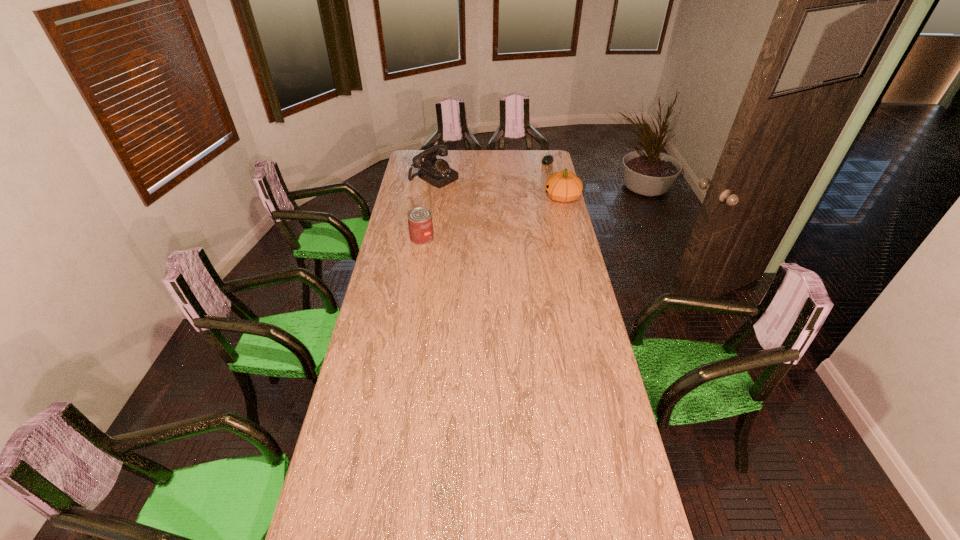
This screenshot has width=960, height=540. In order to click on free space between the gourd and the telephone in this screenshot , I will do [498, 188].

At what (x,y) coordinates should I click in order to perform the action: click on vacant area that lies between the gourd and the telephone. Please return your answer as a coordinate pair (x, y). This screenshot has height=540, width=960. Looking at the image, I should click on (498, 188).

At what (x,y) coordinates should I click in order to perform the action: click on empty space that is in between the can and the gourd. Please return your answer as a coordinate pair (x, y). Looking at the image, I should click on (492, 218).

This screenshot has width=960, height=540. Find the location of `unoccupied position between the third tallest object and the computer mouse`. unoccupied position between the third tallest object and the computer mouse is located at coordinates (485, 200).

This screenshot has width=960, height=540. I want to click on free spot between the farthest object and the nearest object, so click(485, 200).

Locate an element on the screen. This screenshot has width=960, height=540. vacant point located between the second shortest object and the telephone is located at coordinates (428, 208).

Image resolution: width=960 pixels, height=540 pixels. In order to click on free space between the nearest object and the farthest object in this screenshot , I will do `click(485, 200)`.

Where is `free space between the computer mouse and the can`? This screenshot has width=960, height=540. free space between the computer mouse and the can is located at coordinates (485, 200).

Find the location of a particular element. object that is the third closest to the gourd is located at coordinates (420, 223).

At what (x,y) coordinates should I click in order to perform the action: click on object that is the third closest to the gourd. Please return your answer as a coordinate pair (x, y). This screenshot has height=540, width=960. Looking at the image, I should click on click(420, 223).